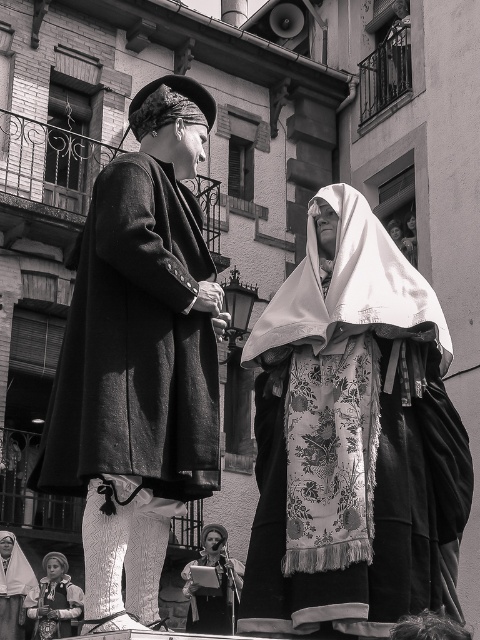
You are organizing a cultural event and need to display the floral fabric robe at center and the floral fabric dress at center on adjacent mannequins. Given their sizes, which one should be placed on the larger mannequin?

The floral fabric robe at center should be placed on the larger mannequin because it has a larger size compared to the floral fabric dress at center.

You are an event photographer at the scene. You need to capture a photo where both the matte black coat at left and the floral fabric dress at center are visible. Based on their positions, which one should you focus on first to ensure both are in frame?

The matte black coat at left is above the floral fabric dress at center, so you should focus on the floral fabric dress at center first to ensure both are in frame.